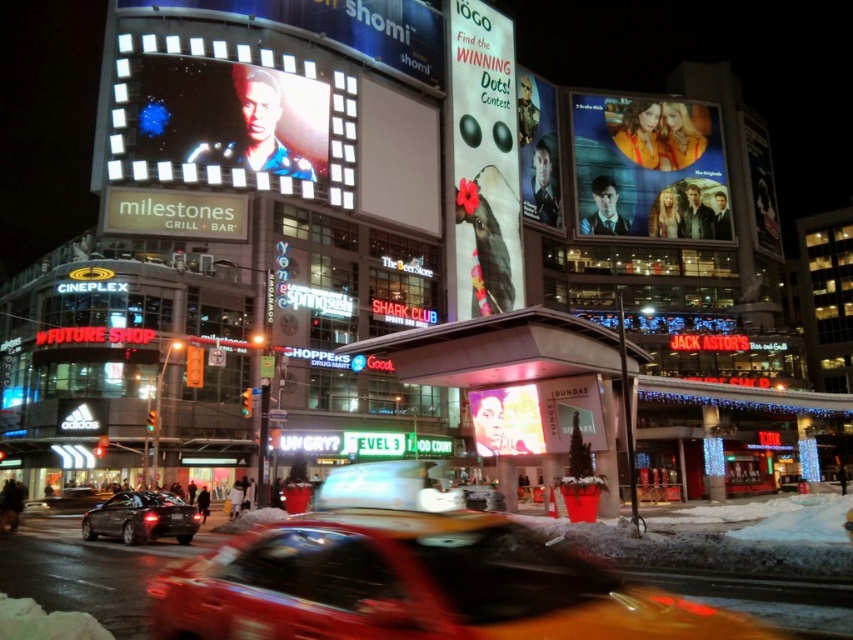
Is matte digital billboard at upper left wider than shiny black sedan at lower left?

Yes.

Does point (428, 12) lie behind point (175, 518)?

Yes, it is.

Between point (271, 1) and point (154, 493), which one is positioned behind?

Positioned behind is point (271, 1).

Where is `matte digital billboard at upper left`? matte digital billboard at upper left is located at coordinates point(334,28).

Between point (665, 218) and point (128, 516), which one is positioned behind?

Positioned behind is point (665, 218).

Between matte plastic poster at upper right and shiny black sedan at lower left, which one is positioned lower?

Positioned lower is shiny black sedan at lower left.

Where is `matte plastic poster at upper right`? The width and height of the screenshot is (853, 640). matte plastic poster at upper right is located at coordinates (648, 168).

Who is shorter, matte plastic poster at upper right or metallic silver car at center?

Standing shorter between the two is metallic silver car at center.

Can you confirm if matte plastic poster at upper right is bigger than metallic silver car at center?

Correct, matte plastic poster at upper right is larger in size than metallic silver car at center.

The image size is (853, 640). What are the coordinates of `matte plastic poster at upper right` in the screenshot? It's located at (648, 168).

This screenshot has height=640, width=853. Identify the location of matte plastic poster at upper right. (648, 168).